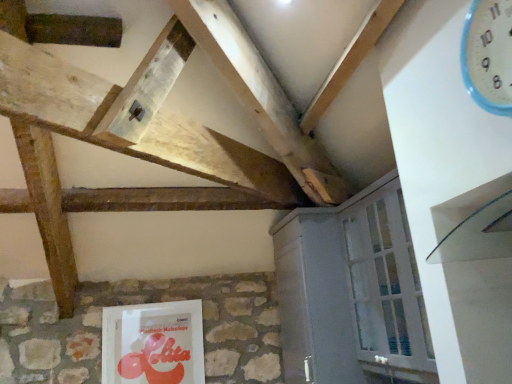
Question: Is white painted wood cabinet at lower right taller or shorter than white plastic clock at upper right?

Choices:
 (A) tall
 (B) short

Answer: (A)

Question: In terms of size, does white painted wood cabinet at lower right appear bigger or smaller than white plastic clock at upper right?

Choices:
 (A) big
 (B) small

Answer: (A)

Question: Estimate the real-world distances between objects in this image. Which object is closer to the white painted wood cabinet at lower right?

Choices:
 (A) matte plastic book at lower center
 (B) white plastic clock at upper right

Answer: (A)

Question: Estimate the real-world distances between objects in this image. Which object is farther from the white plastic clock at upper right?

Choices:
 (A) matte plastic book at lower center
 (B) white painted wood cabinet at lower right

Answer: (A)